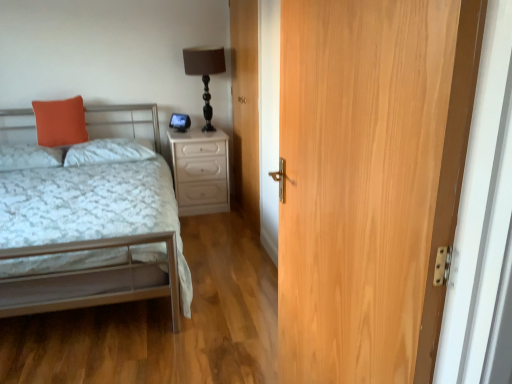
Question: Does white glossy nightstand at center have a greater height compared to metallic silver bed at left?

Choices:
 (A) no
 (B) yes

Answer: (A)

Question: Can you confirm if white glossy nightstand at center is bigger than metallic silver bed at left?

Choices:
 (A) yes
 (B) no

Answer: (B)

Question: Considering the relative sizes of white glossy nightstand at center and metallic silver bed at left in the image provided, is white glossy nightstand at center thinner than metallic silver bed at left?

Choices:
 (A) no
 (B) yes

Answer: (B)

Question: Considering the relative sizes of white glossy nightstand at center and metallic silver bed at left in the image provided, is white glossy nightstand at center shorter than metallic silver bed at left?

Choices:
 (A) yes
 (B) no

Answer: (A)

Question: Is white glossy nightstand at center positioned before metallic silver bed at left?

Choices:
 (A) no
 (B) yes

Answer: (A)

Question: Based on their sizes in the image, would you say white glossy nightstand at center is bigger or smaller than orange fabric pillow at left, placed as the 1th pillow when sorted from left to right?

Choices:
 (A) small
 (B) big

Answer: (B)

Question: Looking at their shapes, would you say white glossy nightstand at center is wider or thinner than orange fabric pillow at left, arranged as the third pillow when viewed from the right?

Choices:
 (A) wide
 (B) thin

Answer: (A)

Question: From the image's perspective, is white glossy nightstand at center positioned above or below orange fabric pillow at left, arranged as the third pillow when viewed from the right?

Choices:
 (A) above
 (B) below

Answer: (B)

Question: Is white glossy nightstand at center in front of or behind orange fabric pillow at left, placed as the 1th pillow when sorted from left to right, in the image?

Choices:
 (A) behind
 (B) front

Answer: (A)

Question: From the image's perspective, relative to orange matte pillow at upper left, arranged as the 2th pillow when viewed from the right, is orange fabric pillow at left, the 3th pillow when ordered from left to right, above or below?

Choices:
 (A) below
 (B) above

Answer: (A)

Question: Relative to orange matte pillow at upper left, marked as the second pillow in a left-to-right arrangement, is orange fabric pillow at left, the 3th pillow when ordered from left to right, in front or behind?

Choices:
 (A) front
 (B) behind

Answer: (A)

Question: Considering the positions of orange fabric pillow at left, marked as the first pillow in a right-to-left arrangement, and orange matte pillow at upper left, marked as the second pillow in a left-to-right arrangement, in the image, is orange fabric pillow at left, marked as the first pillow in a right-to-left arrangement, bigger or smaller than orange matte pillow at upper left, marked as the second pillow in a left-to-right arrangement,?

Choices:
 (A) small
 (B) big

Answer: (B)

Question: Is orange fabric pillow at left, the 3th pillow when ordered from left to right, wider or thinner than orange matte pillow at upper left, marked as the second pillow in a left-to-right arrangement?

Choices:
 (A) thin
 (B) wide

Answer: (B)

Question: Considering the positions of light brown wood door at center, the 2th door from the front, and light brown wood door at right, acting as the 1th door starting from the front, in the image, is light brown wood door at center, the 2th door from the front, bigger or smaller than light brown wood door at right, acting as the 1th door starting from the front,?

Choices:
 (A) small
 (B) big

Answer: (B)

Question: From their relative heights in the image, would you say light brown wood door at center, positioned as the first door in back-to-front order, is taller or shorter than light brown wood door at right, acting as the 1th door starting from the front?

Choices:
 (A) tall
 (B) short

Answer: (A)